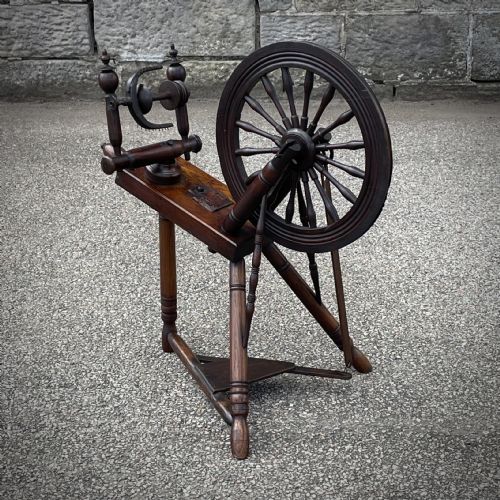
You are a GUI agent. You are given a task and a screenshot of the screen. Output one action in this format:
    pyautogui.click(x=<x>, y=<y>)
    Task: Click on the wooden vertical support
    
    Given the screenshot: What is the action you would take?
    pyautogui.click(x=312, y=268), pyautogui.click(x=335, y=273), pyautogui.click(x=257, y=278)